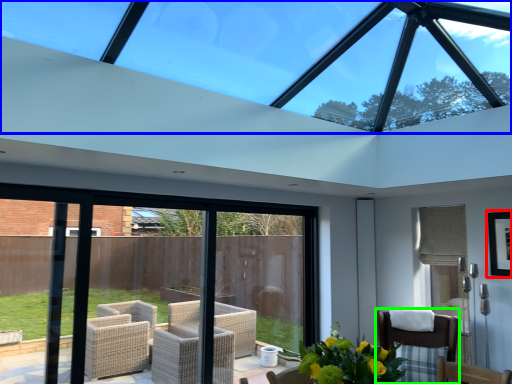
Question: Considering the real-world distances, which object is closest to picture frame (highlighted by a red box)? window (highlighted by a blue box) or chair (highlighted by a green box).

Choices:
 (A) window
 (B) chair

Answer: (B)